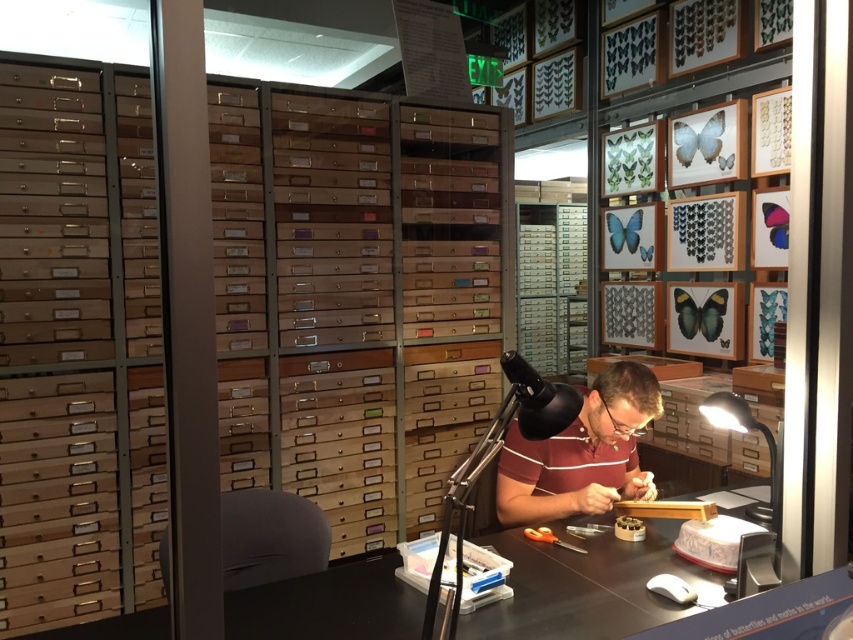
Consider the image. Is wooden desk at center to the left of maroon striped shirt at center from the viewer's perspective?

Correct, you'll find wooden desk at center to the left of maroon striped shirt at center.

Is wooden desk at center wider than maroon striped shirt at center?

Yes.

Does point (378, 632) come behind point (590, 465)?

No, it is not.

Identify the location of wooden desk at center. Image resolution: width=853 pixels, height=640 pixels. (585, 586).